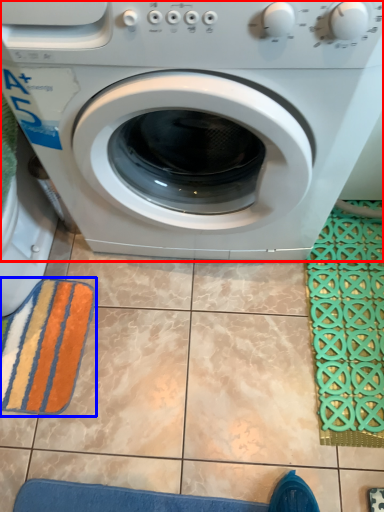
Question: Which point is closer to the camera, washing machine (highlighted by a red box) or bath towel (highlighted by a blue box)?

Choices:
 (A) washing machine
 (B) bath towel

Answer: (A)